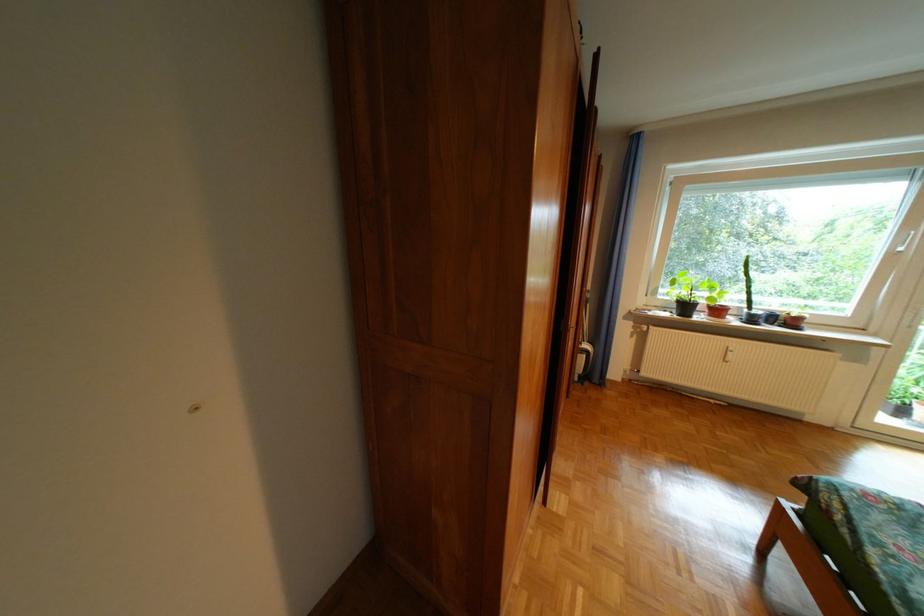
Where would you lift the black potted plant? Please return your answer as a coordinate pair (x, y).

(690, 292)